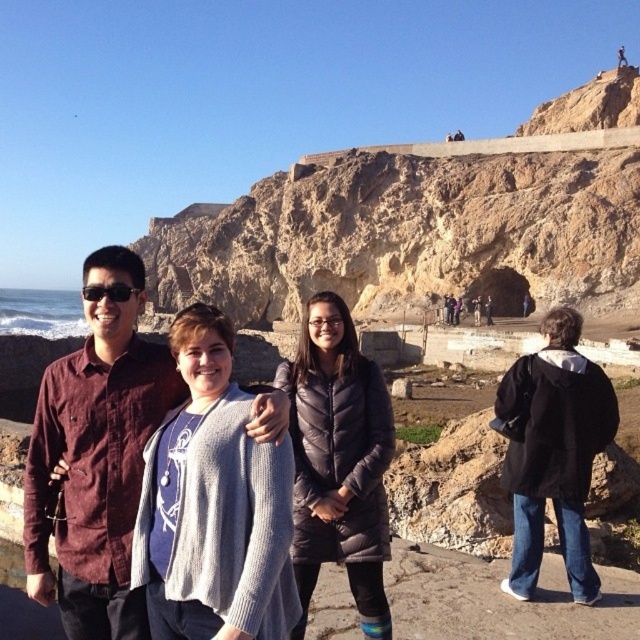
Is rustic stone cliff at upper center to the right of black matte jacket at lower right from the viewer's perspective?

In fact, rustic stone cliff at upper center is to the left of black matte jacket at lower right.

Find the location of `rustic stone cliff at upper center`. rustic stone cliff at upper center is located at coordinates (426, 220).

The width and height of the screenshot is (640, 640). What are the coordinates of `rustic stone cliff at upper center` in the screenshot? It's located at (426, 220).

Is gray knit sweater at center below black puffer jacket at center?

Actually, gray knit sweater at center is above black puffer jacket at center.

Can you confirm if gray knit sweater at center is thinner than black puffer jacket at center?

Incorrect, gray knit sweater at center's width is not less than black puffer jacket at center's.

Locate an element on the screen. The image size is (640, 640). gray knit sweater at center is located at coordinates (561, 406).

Image resolution: width=640 pixels, height=640 pixels. I want to click on gray knit sweater at center, so click(561, 406).

Measure the distance from gray knit sweater at center to black matte jacket at lower right.

gray knit sweater at center and black matte jacket at lower right are 15.86 feet apart from each other.

Is gray knit sweater at center shorter than black matte jacket at lower right?

No.

Is point (353, 396) positioned behind point (582, 552)?

No, (353, 396) is closer to viewer.

Locate an element on the screen. This screenshot has height=640, width=640. gray knit sweater at center is located at coordinates (561, 406).